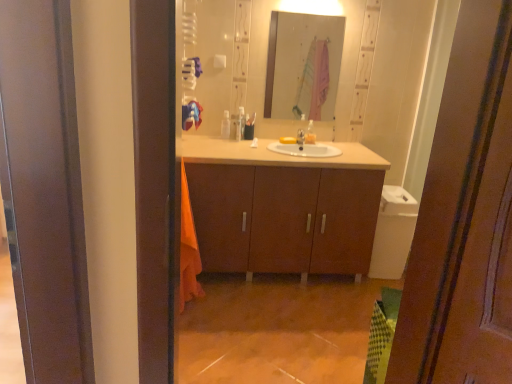
Identify the location of free space in front of translucent plastic bag at center, arranged as the 3th toiletry when viewed from the left. 306,146.